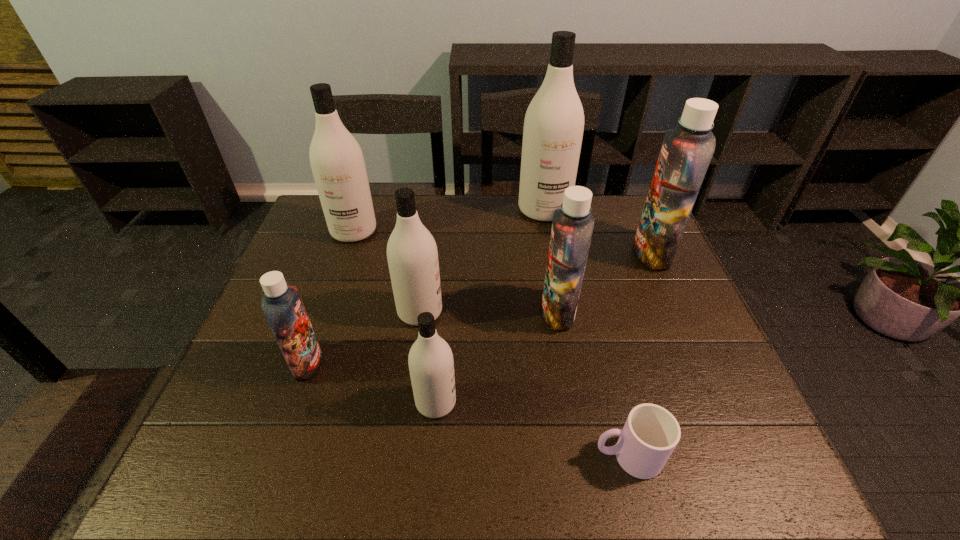
Where is `free space that satisfies the following two spatial constraints: 1. with the handle on the side of the nearest object; 2. on the front-facing side of the rightmost white shampoo`? free space that satisfies the following two spatial constraints: 1. with the handle on the side of the nearest object; 2. on the front-facing side of the rightmost white shampoo is located at coordinates (566, 210).

The image size is (960, 540). In order to click on free space that satisfies the following two spatial constraints: 1. on the front-facing side of the rightmost white shampoo; 2. on the front-facing side of the nearest white shampoo in this screenshot , I will do (x=580, y=402).